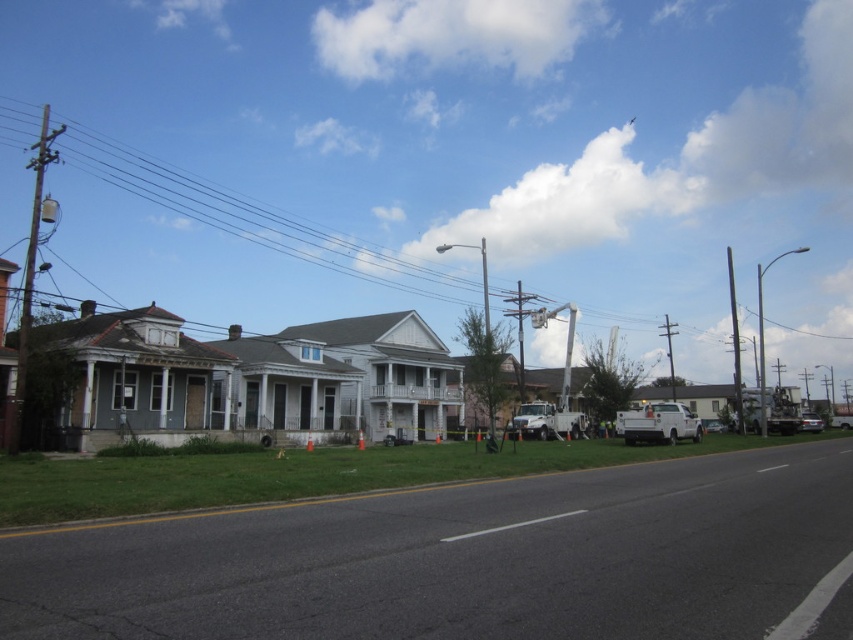
In the scene shown: You are a pedestrian standing on the sidewalk and want to cross the road to the house with boarded windows. The white matte truck at right and the silver metallic sedan at right are parked on the curb. Which vehicle should you walk around to reach the road safely?

The white matte truck at right is located above the silver metallic sedan at right, so you should walk around the silver metallic sedan at right to reach the road safely because it is closer to the sidewalk.

You are a delivery driver who needs to park your 5.5 meter long truck between the white matte truck at right and the silver metallic sedan at right. Based on the scene, can you safely park your truck without overlapping either vehicle?

The white matte truck at right and silver metallic sedan at right are 17.80 meters apart from each other. Since your truck is only 5.5 meters long, there is sufficient space between them to park without overlapping either vehicle.